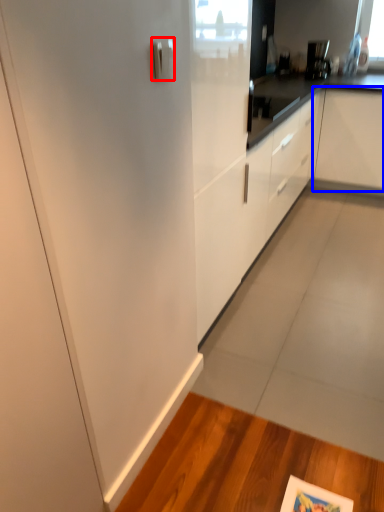
Question: Which of the following is the closest to the observer, door handle (highlighted by a red box) or cabinetry (highlighted by a blue box)?

Choices:
 (A) door handle
 (B) cabinetry

Answer: (A)